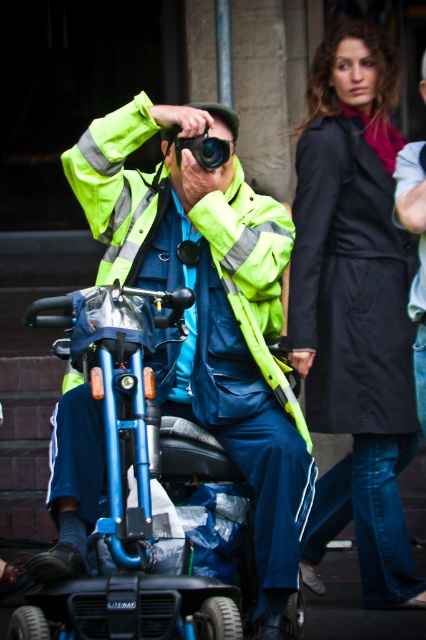
You are a photographer trying to capture a clear shot of the neon yellow reflective jacket at center and the black matte coat at upper right. Which object should you focus on first if you want to ensure both are in focus, considering their sizes in the frame?

The neon yellow reflective jacket at center is taller than the black matte coat at upper right, so you should focus on the neon yellow reflective jacket at center first to ensure both are in focus.

You are a photographer trying to capture the neon yellow reflective jacket at center and the black matte coat at upper right in the same frame. Which object should you focus on first to ensure both are in the shot?

The neon yellow reflective jacket at center is positioned on the left side of black matte coat at upper right, so you should focus on the neon yellow reflective jacket at center first to ensure both are in the shot.

You are a photographer trying to capture the neon yellow reflective jacket at center and the black matte coat at upper right in the same frame. Based on their positions, which one will appear closer to the camera in the photo?

The neon yellow reflective jacket at center appears closer to the camera because it is positioned in front of the black matte coat at upper right.